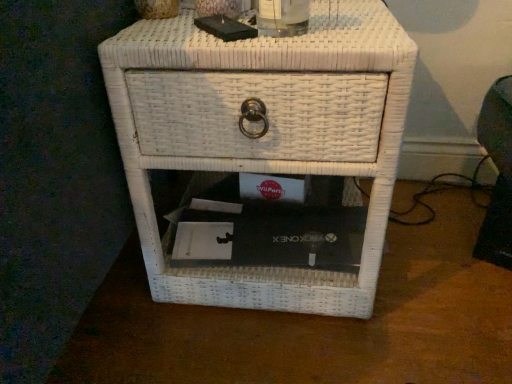
This screenshot has width=512, height=384. Find the location of `white wicker nightstand at center`. white wicker nightstand at center is located at coordinates (265, 149).

The width and height of the screenshot is (512, 384). What do you see at coordinates (265, 149) in the screenshot? I see `white wicker nightstand at center` at bounding box center [265, 149].

What is the approximate width of clear glass bottle at upper center?

3.98 inches.

What do you see at coordinates (282, 17) in the screenshot? The height and width of the screenshot is (384, 512). I see `clear glass bottle at upper center` at bounding box center [282, 17].

Image resolution: width=512 pixels, height=384 pixels. I want to click on clear glass bottle at upper center, so click(x=282, y=17).

The width and height of the screenshot is (512, 384). What are the coordinates of `white wicker nightstand at center` in the screenshot? It's located at (265, 149).

Which object is positioned more to the right, white wicker nightstand at center or clear glass bottle at upper center?

Positioned to the right is clear glass bottle at upper center.

Is white wicker nightstand at center closer to the viewer compared to clear glass bottle at upper center?

No, it is not.

Between point (178, 70) and point (294, 23), which one is positioned in front?

Positioned in front is point (178, 70).

From the image's perspective, which one is positioned higher, white wicker nightstand at center or clear glass bottle at upper center?

From the image's view, clear glass bottle at upper center is above.

From a real-world perspective, is white wicker nightstand at center physically above clear glass bottle at upper center?

No, from a real-world perspective, white wicker nightstand at center is not over clear glass bottle at upper center

Between white wicker nightstand at center and clear glass bottle at upper center, which one has smaller width?

clear glass bottle at upper center.

Does white wicker nightstand at center have a greater height compared to clear glass bottle at upper center?

Correct, white wicker nightstand at center is much taller as clear glass bottle at upper center.

Which of these two, white wicker nightstand at center or clear glass bottle at upper center, is bigger?

With larger size is white wicker nightstand at center.

From the picture: Choose the correct answer: Is white wicker nightstand at center inside clear glass bottle at upper center or outside it?

white wicker nightstand at center lies outside clear glass bottle at upper center.

Is white wicker nightstand at center far away from clear glass bottle at upper center?

white wicker nightstand at center is actually quite close to clear glass bottle at upper center.

Is white wicker nightstand at center aimed at clear glass bottle at upper center?

No, white wicker nightstand at center is not turned towards clear glass bottle at upper center.

Locate an element on the screen. The image size is (512, 384). nightstand behind the clear glass bottle at upper center is located at coordinates (265, 149).

Considering the relative positions of clear glass bottle at upper center and white wicker nightstand at center in the image provided, is clear glass bottle at upper center to the left of white wicker nightstand at center from the viewer's perspective?

In fact, clear glass bottle at upper center is to the right of white wicker nightstand at center.

Is the position of clear glass bottle at upper center more distant than that of white wicker nightstand at center?

No, clear glass bottle at upper center is in front of white wicker nightstand at center.

Does point (262, 30) lie behind point (137, 116)?

Yes.

From the image's perspective, between clear glass bottle at upper center and white wicker nightstand at center, who is located below?

white wicker nightstand at center, from the image's perspective.

From a real-world perspective, who is located higher, clear glass bottle at upper center or white wicker nightstand at center?

clear glass bottle at upper center is physically above.

Is clear glass bottle at upper center thinner than white wicker nightstand at center?

Indeed, clear glass bottle at upper center has a lesser width compared to white wicker nightstand at center.

Between clear glass bottle at upper center and white wicker nightstand at center, which one has more height?

With more height is white wicker nightstand at center.

Considering the relative sizes of clear glass bottle at upper center and white wicker nightstand at center in the image provided, is clear glass bottle at upper center smaller than white wicker nightstand at center?

Indeed, clear glass bottle at upper center has a smaller size compared to white wicker nightstand at center.

Is clear glass bottle at upper center inside or outside of white wicker nightstand at center?

clear glass bottle at upper center is spatially situated outside white wicker nightstand at center.

Is clear glass bottle at upper center directly adjacent to white wicker nightstand at center?

No, clear glass bottle at upper center is not touching white wicker nightstand at center.

Is clear glass bottle at upper center turned away from white wicker nightstand at center?

No, clear glass bottle at upper center is not facing the opposite direction of white wicker nightstand at center.

Locate an element on the screen. This screenshot has height=384, width=512. beverage above the white wicker nightstand at center (from the image's perspective) is located at coordinates (282, 17).

This screenshot has height=384, width=512. I want to click on nightstand that is under the clear glass bottle at upper center (from a real-world perspective), so click(x=265, y=149).

The height and width of the screenshot is (384, 512). Find the location of `beverage above the white wicker nightstand at center (from a real-world perspective)`. beverage above the white wicker nightstand at center (from a real-world perspective) is located at coordinates tap(282, 17).